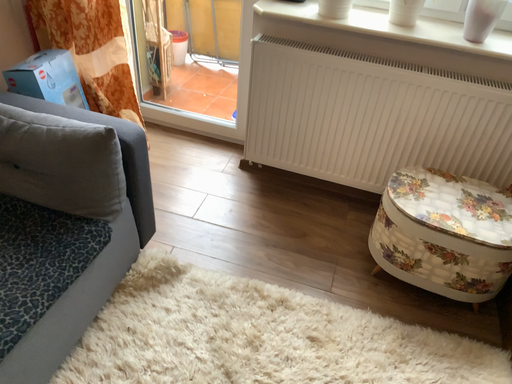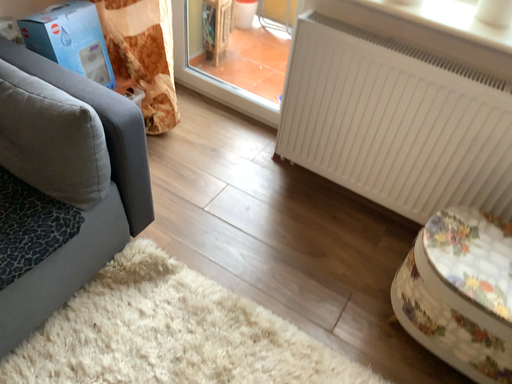
Question: How did the camera likely rotate when shooting the video?

Choices:
 (A) rotated left
 (B) rotated right

Answer: (A)